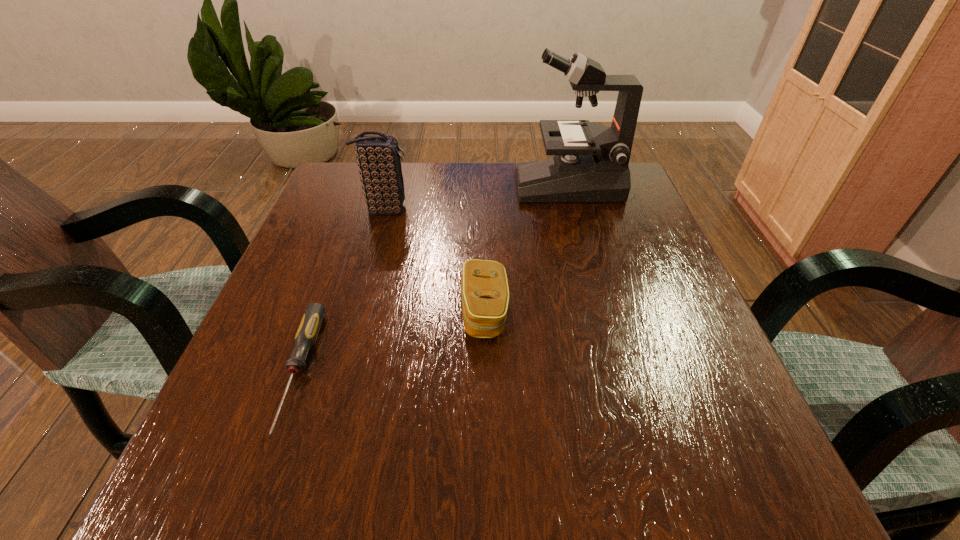
This screenshot has width=960, height=540. Identify the location of vacant space located 0.080m with the zip open on the farther clutch bag. (444, 210).

You are a GUI agent. You are given a task and a screenshot of the screen. Output one action in this format:
    pyautogui.click(x=<x>, y=<y>)
    Task: Click on the free location located 0.180m on the zipper side of the third tallest object
    The width and height of the screenshot is (960, 540).
    Given the screenshot: What is the action you would take?
    pyautogui.click(x=360, y=312)

Image resolution: width=960 pixels, height=540 pixels. What are the coordinates of `free spot located on the zipper side of the third tallest object` in the screenshot? It's located at (382, 312).

The width and height of the screenshot is (960, 540). In order to click on vacant space located 0.250m on the zipper side of the third tallest object in this screenshot , I will do `click(322, 312)`.

The height and width of the screenshot is (540, 960). Identify the location of microscope located at the far edge. (590, 164).

Identify the location of clutch bag positioned at the far edge. (379, 163).

This screenshot has height=540, width=960. Identify the location of object located at the near edge. (308, 330).

The height and width of the screenshot is (540, 960). Identify the location of clutch bag positioned at the left edge. (379, 163).

Find the location of a particular element. screwdriver that is at the left edge is located at coordinates (308, 330).

Identify the location of object situated at the right edge. This screenshot has width=960, height=540. (590, 164).